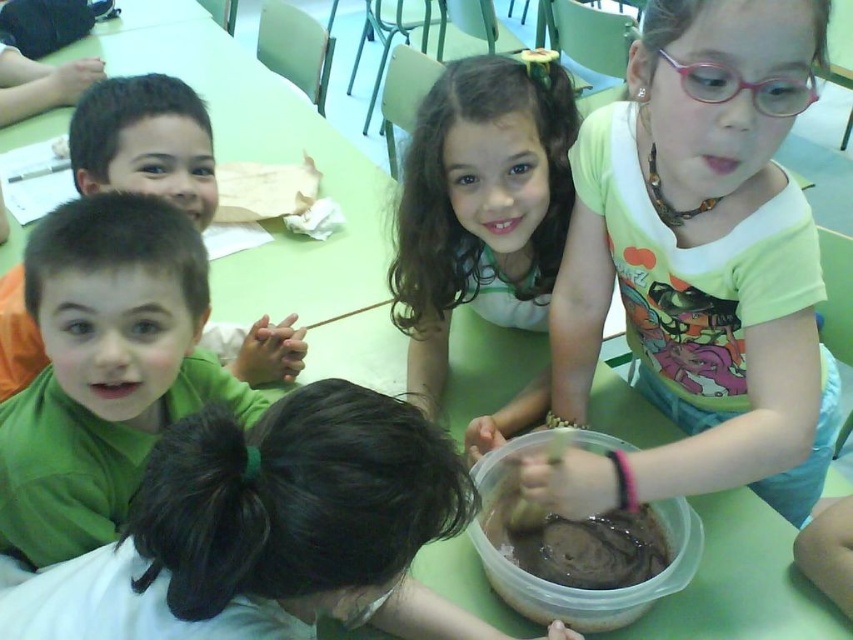
Between point (413, 179) and point (495, 577), which one is positioned behind?

The point (413, 179) is more distant.

Is point (543, 324) positioned after point (701, 529)?

That is True.

Identify the location of curly brown hair at upper center. This screenshot has height=640, width=853. (480, 205).

Can you confirm if dark brown hair at center is thinner than green matte shirt at upper left?

No.

Who is more forward, (172, 442) or (96, 216)?

Point (172, 442) is more forward.

Locate an element on the screen. dark brown hair at center is located at coordinates (270, 529).

Between point (77, 124) and point (602, 602), which one is positioned behind?

Positioned behind is point (77, 124).

Is green matte shirt at left taller than brown matte plastic bowl at lower center?

Correct, green matte shirt at left is much taller as brown matte plastic bowl at lower center.

Describe the element at coordinates (144, 141) in the screenshot. I see `green matte shirt at left` at that location.

Locate an element on the screen. The width and height of the screenshot is (853, 640). green matte shirt at left is located at coordinates (144, 141).